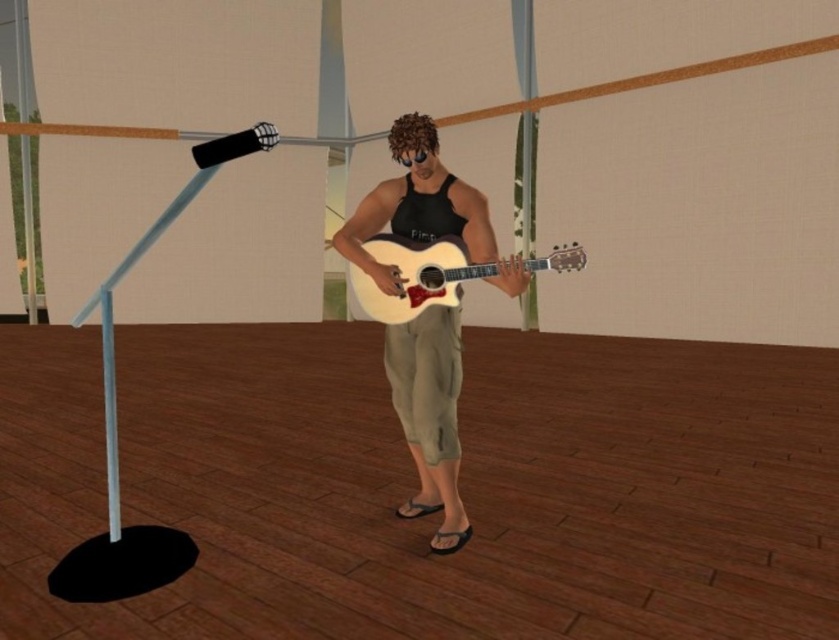
Who is more distant from viewer, (395, 289) or (431, 278)?

The point (431, 278) is behind.

Is point (441, 547) behind point (391, 257)?

No, (441, 547) is in front of (391, 257).

Find the location of a particular element. matte black tank top at center is located at coordinates (425, 211).